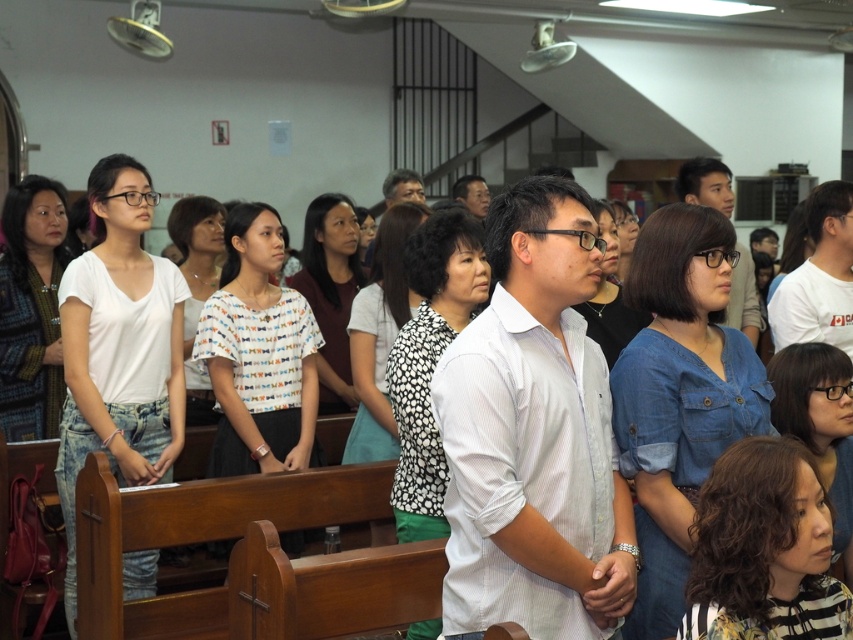
Who is more distant from viewer, (596, 627) or (466, 180)?

The point (466, 180) is more distant.

Which of these two, white striped shirt at center or matte black shirt at center, stands shorter?

matte black shirt at center

Who is more distant from viewer, (463, 552) or (476, 212)?

The point (476, 212) is more distant.

The width and height of the screenshot is (853, 640). I want to click on white striped shirt at center, so click(534, 435).

Is white striped shirt at center positioned behind matte white shirt at center?

No, it is in front of matte white shirt at center.

Does white striped shirt at center have a lesser height compared to matte white shirt at center?

In fact, white striped shirt at center may be taller than matte white shirt at center.

Does point (560, 180) lie behind point (749, 260)?

No, (560, 180) is closer to viewer.

The width and height of the screenshot is (853, 640). I want to click on white striped shirt at center, so click(x=534, y=435).

Between matte white shirt at center and matte black shirt at center, which one is positioned higher?

matte black shirt at center is higher up.

Image resolution: width=853 pixels, height=640 pixels. I want to click on matte white shirt at center, so click(705, 182).